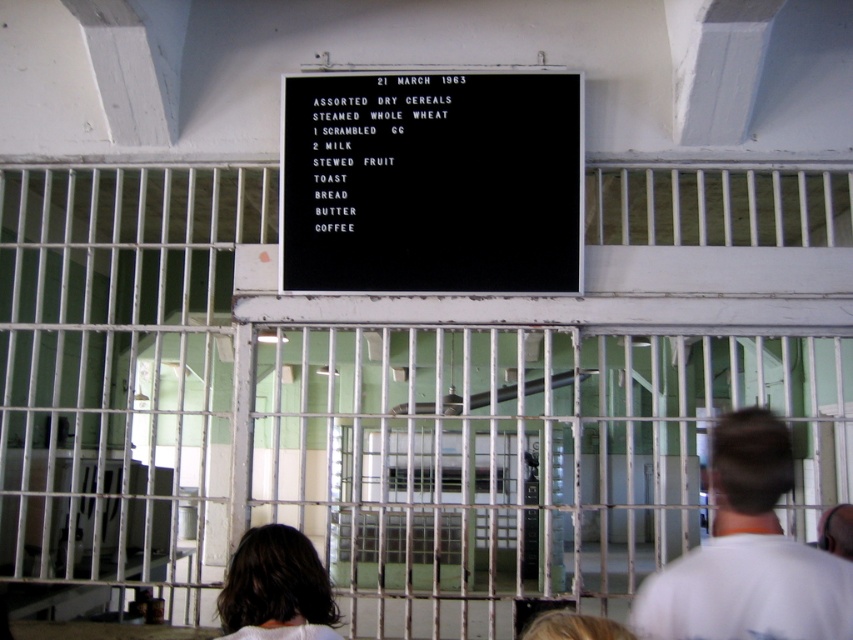
You are an inmate in this prison and you want to reach the black plastic signboard at center to read it better. Which direction should you move relative to the white metal bars at center?

You should move to the right side of the white metal bars at center to reach the black plastic signboard at center because the white metal bars at center is positioned on the left side of black plastic signboard at center.

You are standing in the prison and want to determine which of the two points, point (554, 390) or point (308, 582), is closer to you. Based on the scene, which point is nearer?

Point (554, 390) is further to the viewer than point (308, 582), so the closer point is point (308, 582).